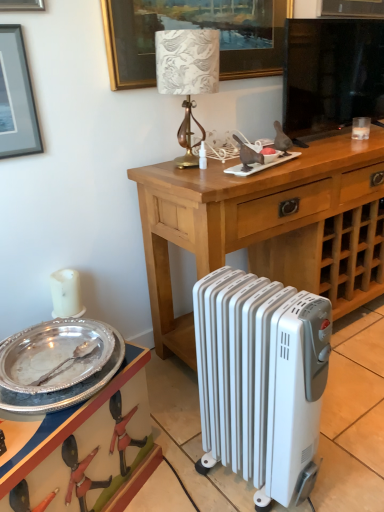
Question: Is silver metallic tray at lower left looking in the opposite direction of silver/golden picture frame at upper center, which is the first picture frame in right-to-left order?

Choices:
 (A) yes
 (B) no

Answer: (B)

Question: Is silver metallic tray at lower left to the left of silver/golden picture frame at upper center, which appears as the 2th picture frame when ordered from the bottom, from the viewer's perspective?

Choices:
 (A) yes
 (B) no

Answer: (A)

Question: From a real-world perspective, does silver metallic tray at lower left sit lower than silver/golden picture frame at upper center, marked as the second picture frame in a front-to-back arrangement?

Choices:
 (A) no
 (B) yes

Answer: (B)

Question: Is silver metallic tray at lower left thinner than silver/golden picture frame at upper center, which is the first picture frame in right-to-left order?

Choices:
 (A) no
 (B) yes

Answer: (A)

Question: Considering the relative sizes of silver metallic tray at lower left and silver/golden picture frame at upper center, which is the first picture frame from top to bottom, in the image provided, is silver metallic tray at lower left smaller than silver/golden picture frame at upper center, which is the first picture frame from top to bottom,?

Choices:
 (A) no
 (B) yes

Answer: (A)

Question: Is silver metallic tray at lower left bigger than silver/golden picture frame at upper center, which is the first picture frame from top to bottom?

Choices:
 (A) yes
 (B) no

Answer: (A)

Question: Considering the relative sizes of silver/glossy plate at lower left and wooden desk at center in the image provided, is silver/glossy plate at lower left thinner than wooden desk at center?

Choices:
 (A) no
 (B) yes

Answer: (B)

Question: Is silver/glossy plate at lower left completely or partially outside of wooden desk at center?

Choices:
 (A) yes
 (B) no

Answer: (A)

Question: Is silver/glossy plate at lower left beside wooden desk at center?

Choices:
 (A) no
 (B) yes

Answer: (A)

Question: Could you tell me if silver/glossy plate at lower left is turned towards wooden desk at center?

Choices:
 (A) yes
 (B) no

Answer: (B)

Question: From the image's perspective, is silver/glossy plate at lower left under wooden desk at center?

Choices:
 (A) yes
 (B) no

Answer: (A)

Question: Does silver/glossy plate at lower left have a smaller size compared to wooden desk at center?

Choices:
 (A) no
 (B) yes

Answer: (B)

Question: Is black glass television at upper center surrounded by wooden desk at center?

Choices:
 (A) no
 (B) yes

Answer: (A)